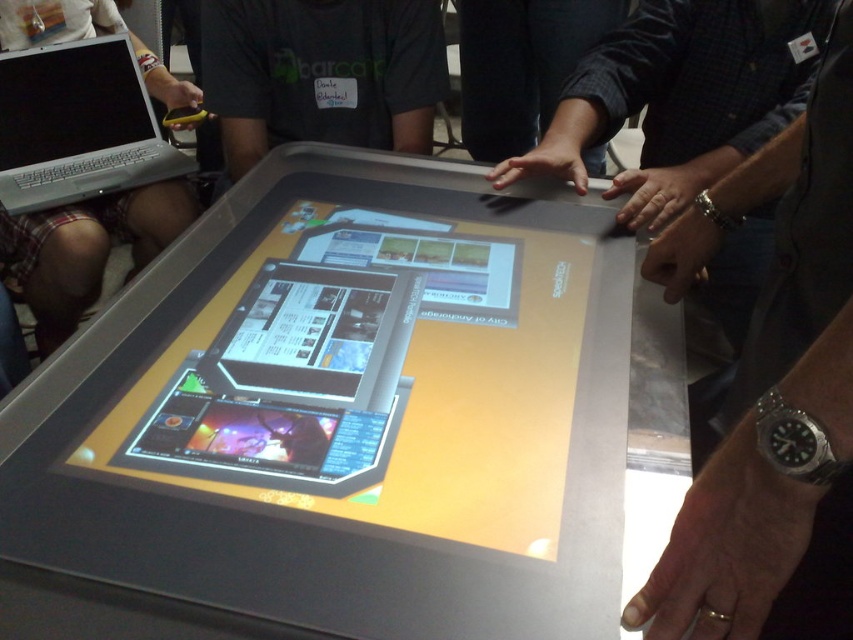
Is metallic silver watch at lower right below silver metallic laptop at upper left?

Indeed, metallic silver watch at lower right is positioned under silver metallic laptop at upper left.

Who is positioned more to the right, metallic silver watch at lower right or silver metallic laptop at upper left?

Positioned to the right is metallic silver watch at lower right.

Locate an element on the screen. The height and width of the screenshot is (640, 853). metallic silver watch at lower right is located at coordinates (773, 396).

Is point (842, 432) positioned after point (355, 8)?

No, it is in front of (355, 8).

The width and height of the screenshot is (853, 640). Find the location of `metallic silver watch at lower right`. metallic silver watch at lower right is located at coordinates (773, 396).

Between black fabric shirt at upper center and silver metallic laptop at upper left, which one has less height?

black fabric shirt at upper center

Between point (399, 141) and point (70, 131), which one is positioned behind?

The point (70, 131) is more distant.

The width and height of the screenshot is (853, 640). I want to click on black fabric shirt at upper center, so click(x=321, y=74).